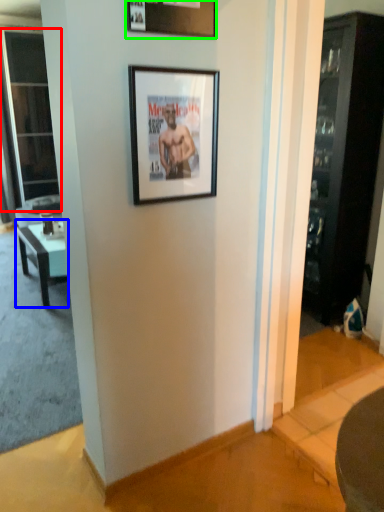
Question: Which is nearer to the screen door (highlighted by a red box)? table (highlighted by a blue box) or picture frame (highlighted by a green box).

Choices:
 (A) table
 (B) picture frame

Answer: (A)